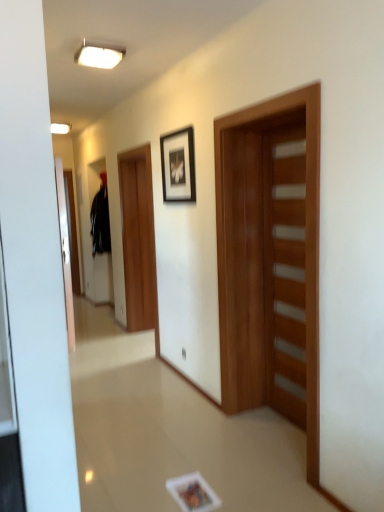
Question: From the image's perspective, is black matte picture frame at upper center over black matte sweatshirt at left?

Choices:
 (A) no
 (B) yes

Answer: (B)

Question: Is black matte picture frame at upper center looking in the opposite direction of black matte sweatshirt at left?

Choices:
 (A) no
 (B) yes

Answer: (A)

Question: Is black matte picture frame at upper center smaller than black matte sweatshirt at left?

Choices:
 (A) no
 (B) yes

Answer: (B)

Question: Is black matte picture frame at upper center taller than black matte sweatshirt at left?

Choices:
 (A) no
 (B) yes

Answer: (A)

Question: From the image's perspective, is black matte picture frame at upper center under black matte sweatshirt at left?

Choices:
 (A) yes
 (B) no

Answer: (B)

Question: Based on their positions, is black matte picture frame at upper center located to the left or right of wooden door at right, marked as the first door in a right-to-left arrangement?

Choices:
 (A) right
 (B) left

Answer: (B)

Question: From the image's perspective, relative to wooden door at right, which ranks as the 2th door in left-to-right order, is black matte picture frame at upper center above or below?

Choices:
 (A) below
 (B) above

Answer: (B)

Question: Is black matte picture frame at upper center inside or outside of wooden door at right, marked as the first door in a right-to-left arrangement?

Choices:
 (A) outside
 (B) inside

Answer: (A)

Question: Is black matte picture frame at upper center in front of or behind wooden door at right, which ranks as the 2th door in left-to-right order, in the image?

Choices:
 (A) behind
 (B) front

Answer: (A)

Question: Considering the positions of point (96, 232) and point (289, 108), is point (96, 232) closer or farther from the camera than point (289, 108)?

Choices:
 (A) farther
 (B) closer

Answer: (A)

Question: From a real-world perspective, is black matte sweatshirt at left above or below wooden door at center, marked as the 1th door in a left-to-right arrangement?

Choices:
 (A) above
 (B) below

Answer: (A)

Question: In the image, is black matte sweatshirt at left positioned in front of or behind wooden door at center, marked as the 1th door in a left-to-right arrangement?

Choices:
 (A) front
 (B) behind

Answer: (B)

Question: Considering the positions of black matte sweatshirt at left and wooden door at center, which is the 2th door from right to left, in the image, is black matte sweatshirt at left bigger or smaller than wooden door at center, which is the 2th door from right to left,?

Choices:
 (A) big
 (B) small

Answer: (B)

Question: Would you say white glossy ceiling light at upper center is to the left or to the right of wooden door at center, marked as the 1th door in a left-to-right arrangement, in the picture?

Choices:
 (A) right
 (B) left

Answer: (B)

Question: From the image's perspective, is white glossy ceiling light at upper center positioned above or below wooden door at center, which is the 2th door from right to left?

Choices:
 (A) below
 (B) above

Answer: (B)